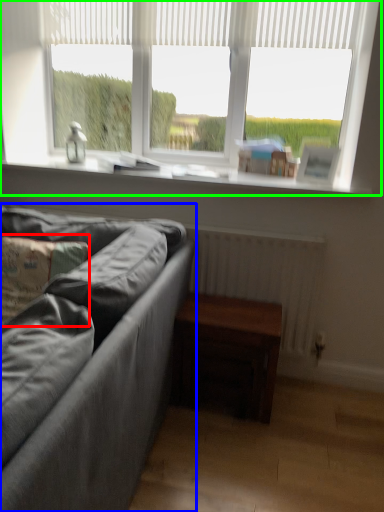
Question: Considering the real-world distances, which object is closest to pillow (highlighted by a red box)? studio couch (highlighted by a blue box) or window (highlighted by a green box).

Choices:
 (A) studio couch
 (B) window

Answer: (A)